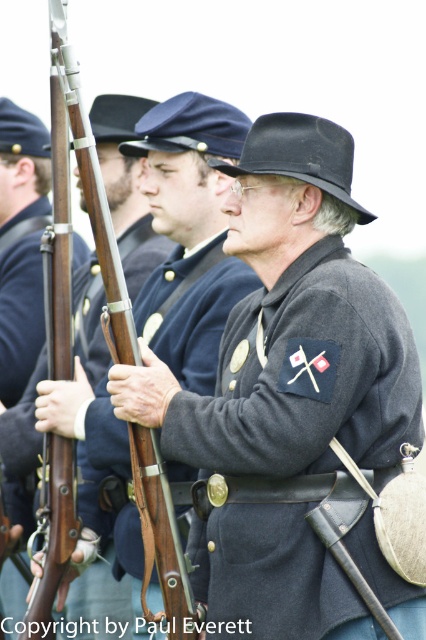
Based on the scene description, where exactly is the matte gray uniform at center located in terms of coordinates?

The matte gray uniform at center is located at coordinates point (189, 234).

You are a photographer standing at the center of the scene. You want to take a photo that includes both the point at coordinates point (193,344) and point (39,186). Which point should you focus on to ensure both are in sharp focus?

You should focus on point (39,186) because it is farther from the camera, and focusing on the farther point will keep both points in focus due to the depth of field.